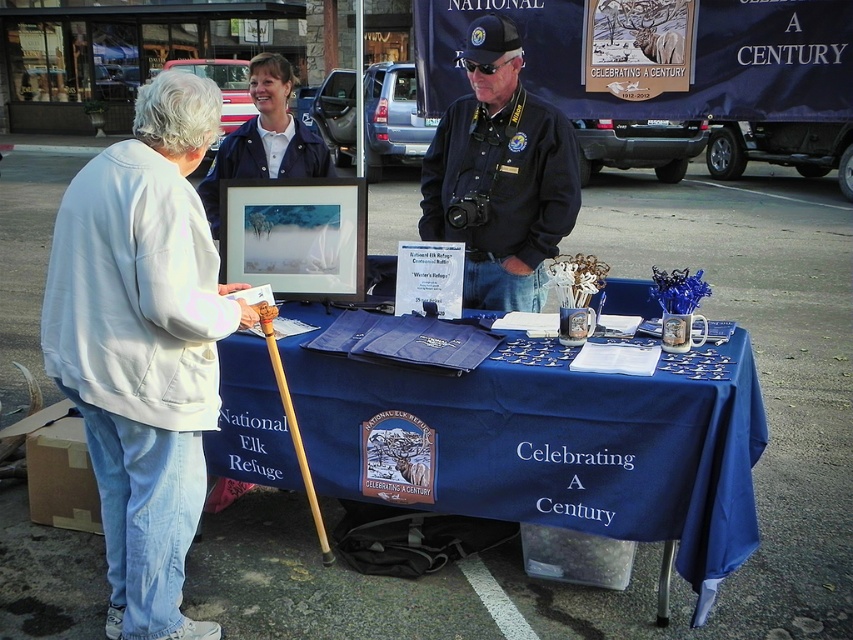
Is white cotton jacket at left wider than dark blue uniform at center?

Yes.

Can you confirm if white cotton jacket at left is shorter than dark blue uniform at center?

Incorrect, white cotton jacket at left's height does not fall short of dark blue uniform at center's.

Does point (111, 212) come farther from viewer compared to point (450, 106)?

No, it is in front of (450, 106).

Where is `white cotton jacket at left`? The image size is (853, 640). white cotton jacket at left is located at coordinates (143, 344).

Between blue fabric table at center and white cotton jacket at left, which one is positioned higher?

white cotton jacket at left

Who is shorter, blue fabric table at center or white cotton jacket at left?

With less height is blue fabric table at center.

Who is more distant from viewer, (750,358) or (209,304)?

Positioned behind is point (750,358).

The height and width of the screenshot is (640, 853). I want to click on blue fabric table at center, so click(x=558, y=448).

Who is positioned more to the right, blue fabric table at center or dark blue uniform at center?

dark blue uniform at center is more to the right.

Between blue fabric table at center and dark blue uniform at center, which one has more height?

dark blue uniform at center is taller.

Does point (642, 484) come behind point (572, 177)?

That is False.

The image size is (853, 640). I want to click on blue fabric table at center, so click(558, 448).